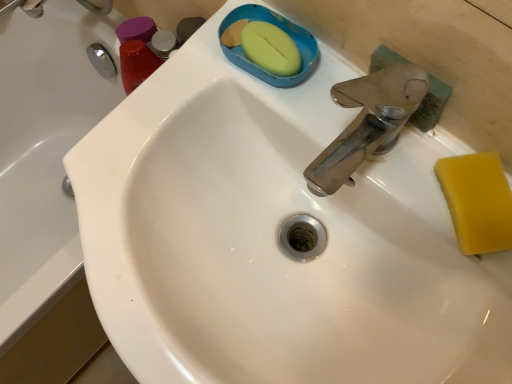
Question: Do you think white glossy sink at center is within yellow sponge at right, or outside of it?

Choices:
 (A) outside
 (B) inside

Answer: (A)

Question: From the image's perspective, is white glossy sink at center above or below yellow sponge at right?

Choices:
 (A) above
 (B) below

Answer: (B)

Question: In terms of size, does white glossy sink at center appear bigger or smaller than yellow sponge at right?

Choices:
 (A) small
 (B) big

Answer: (B)

Question: From a real-world perspective, is yellow sponge at right positioned above or below white glossy sink at center?

Choices:
 (A) above
 (B) below

Answer: (A)

Question: Is point (467, 153) positioned closer to the camera than point (105, 97)?

Choices:
 (A) closer
 (B) farther

Answer: (A)

Question: In terms of width, does yellow sponge at right look wider or thinner when compared to white glossy sink at center?

Choices:
 (A) wide
 (B) thin

Answer: (B)

Question: From the image's perspective, relative to white glossy sink at center, is yellow sponge at right above or below?

Choices:
 (A) below
 (B) above

Answer: (B)